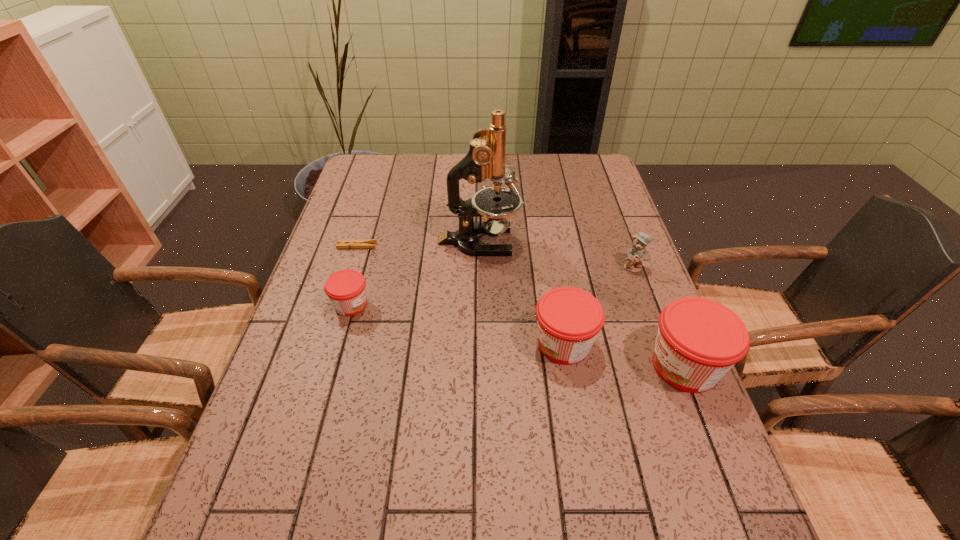
Where is `clothespin positioned at the left edge`? clothespin positioned at the left edge is located at coordinates (365, 243).

At what (x,y) coordinates should I click in order to perform the action: click on jam at the right edge. Please return your answer as a coordinate pair (x, y). Image resolution: width=960 pixels, height=540 pixels. Looking at the image, I should click on (699, 340).

Where is `teddy bear at the right edge`? The height and width of the screenshot is (540, 960). teddy bear at the right edge is located at coordinates (638, 253).

Where is `vacant point at the far edge`? The height and width of the screenshot is (540, 960). vacant point at the far edge is located at coordinates (398, 185).

In the image, there is a desktop. Where is `vacant space at the near edge`? The height and width of the screenshot is (540, 960). vacant space at the near edge is located at coordinates (539, 482).

The width and height of the screenshot is (960, 540). In order to click on vacant space at the left edge of the desktop in this screenshot , I will do `click(334, 333)`.

You are a GUI agent. You are given a task and a screenshot of the screen. Output one action in this format:
    pyautogui.click(x=<x>, y=<y>)
    Task: Click on the free location at the right edge
    
    Given the screenshot: What is the action you would take?
    pyautogui.click(x=579, y=235)

Locate an element on the screen. The image size is (960, 540). blank area at the far left corner is located at coordinates (357, 161).

Locate an element on the screen. The width and height of the screenshot is (960, 540). vacant position at the far right corner of the desktop is located at coordinates (600, 188).

Where is `vacant space that is in between the teddy bear and the leftmost jam`? Image resolution: width=960 pixels, height=540 pixels. vacant space that is in between the teddy bear and the leftmost jam is located at coordinates (492, 286).